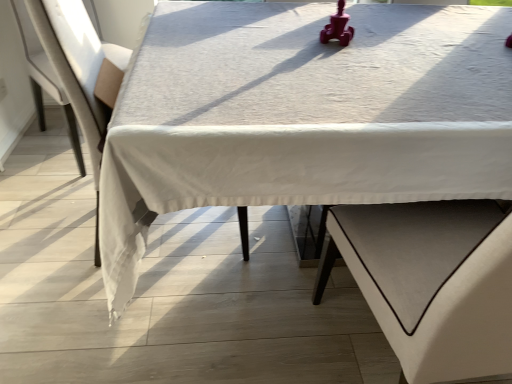
Question: Is white fabric table at center positioned behind white fabric armchair at left?

Choices:
 (A) no
 (B) yes

Answer: (A)

Question: Is white fabric table at center smaller than white fabric armchair at left?

Choices:
 (A) no
 (B) yes

Answer: (A)

Question: Is white fabric table at center positioned in front of white fabric armchair at left?

Choices:
 (A) yes
 (B) no

Answer: (A)

Question: Is white fabric armchair at left at the back of white fabric table at center?

Choices:
 (A) yes
 (B) no

Answer: (B)

Question: Is white fabric table at center aimed at white fabric armchair at left?

Choices:
 (A) no
 (B) yes

Answer: (A)

Question: Does white fabric table at center have a lesser width compared to white fabric armchair at left?

Choices:
 (A) yes
 (B) no

Answer: (B)

Question: Is white fabric armchair at left wider than white fabric table at center?

Choices:
 (A) no
 (B) yes

Answer: (A)

Question: Does white fabric armchair at left turn towards white fabric table at center?

Choices:
 (A) no
 (B) yes

Answer: (B)

Question: Is white fabric armchair at left behind white fabric table at center?

Choices:
 (A) yes
 (B) no

Answer: (A)

Question: Is white fabric armchair at left bigger than white fabric table at center?

Choices:
 (A) no
 (B) yes

Answer: (A)

Question: From a real-world perspective, is white fabric armchair at left physically above white fabric table at center?

Choices:
 (A) yes
 (B) no

Answer: (A)

Question: Can you confirm if white fabric armchair at left is thinner than white fabric table at center?

Choices:
 (A) no
 (B) yes

Answer: (B)

Question: Considering the positions of white fabric armchair at left and white fabric table at center in the image, is white fabric armchair at left wider or thinner than white fabric table at center?

Choices:
 (A) thin
 (B) wide

Answer: (A)